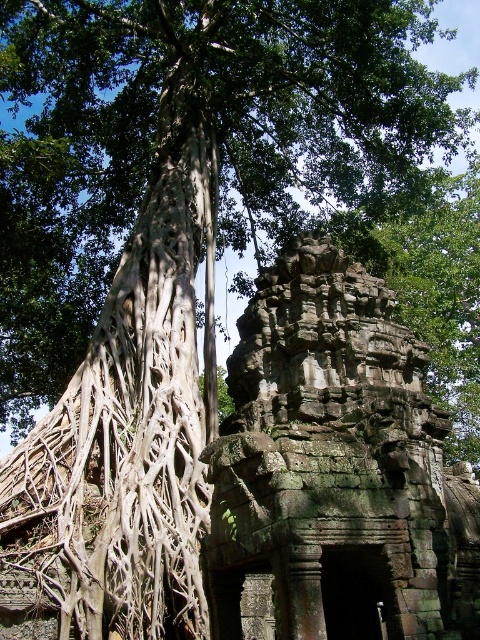
You are an archaeologist examining the site. You need to determine which object occupies more space in the scene. Based on the image, which is larger in size between the gray stone ruins at center and the white textured roots at left?

The gray stone ruins at center is bigger than the white textured roots at left, so the gray stone ruins at center occupies more space in the scene.

You are an archaeologist examining the site. You need to determine if the gray stone ruins at center can fit entirely within the area covered by the white textured roots at left. Based on their widths, what is your conclusion?

The gray stone ruins at center might be wider than white textured roots at left, so it is possible that the ruins cannot fit entirely within the area covered by the roots.